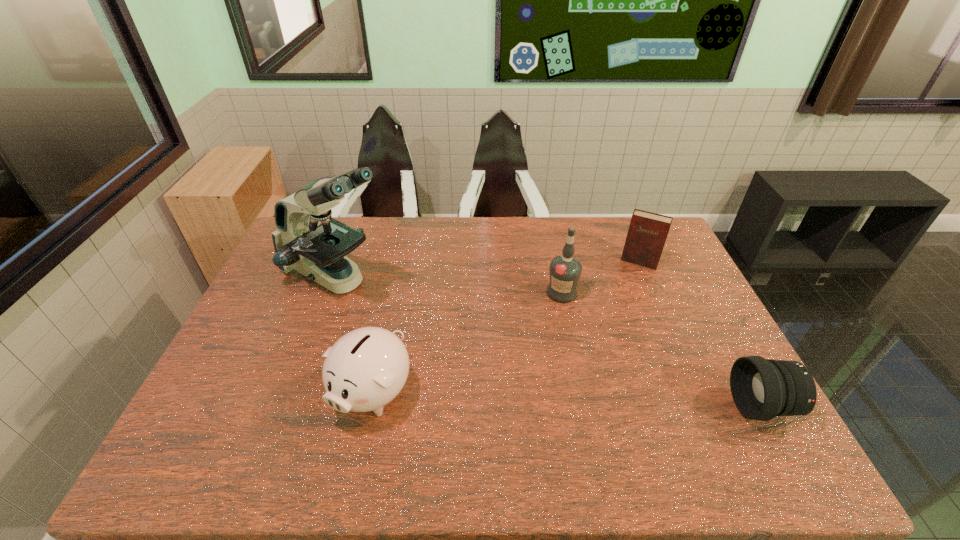
Identify the location of free space in the image that satisfies the following two spatial constraints: 1. on the back side of the second object from right to left; 2. on the left side of the piggy bank. (400, 262).

Locate an element on the screen. free space in the image that satisfies the following two spatial constraints: 1. on the back side of the piggy bank; 2. on the left side of the vodka is located at coordinates (395, 293).